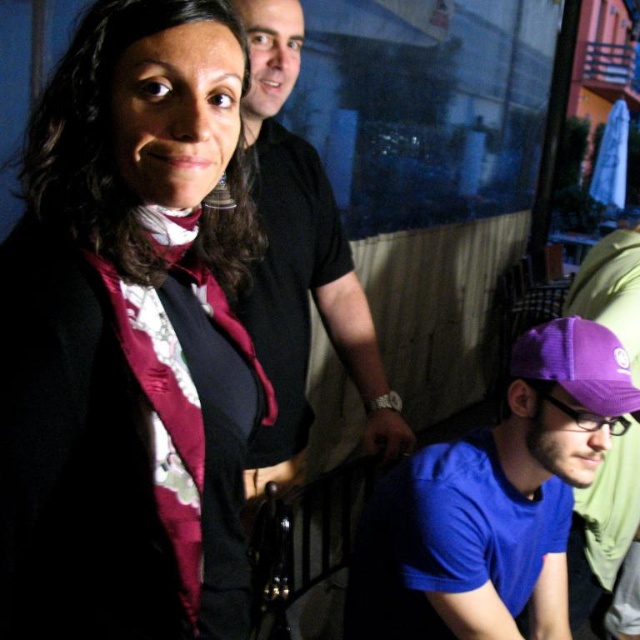
You are a photographer adjusting your camera settings to focus on the satin floral blouse at upper left. Given the coordinates provided, can you determine if the blouse is positioned within the left half of the image?

The satin floral blouse at upper left is located at point (128,337). Since the x coordinate is 0.528, which is slightly above 0.5, it is positioned just beyond the left half of the image.